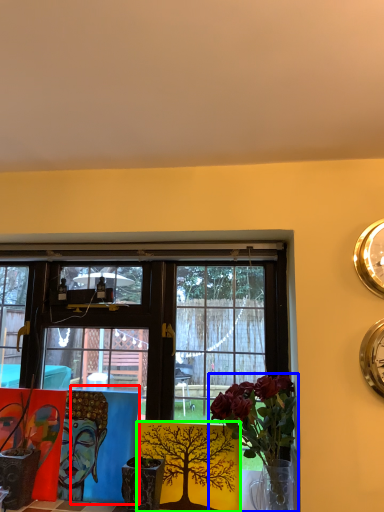
Question: Considering the real-world distances, which object is closest to table (highlighted by a red box)? houseplant (highlighted by a blue box) or floral arrangement (highlighted by a green box).

Choices:
 (A) houseplant
 (B) floral arrangement

Answer: (B)